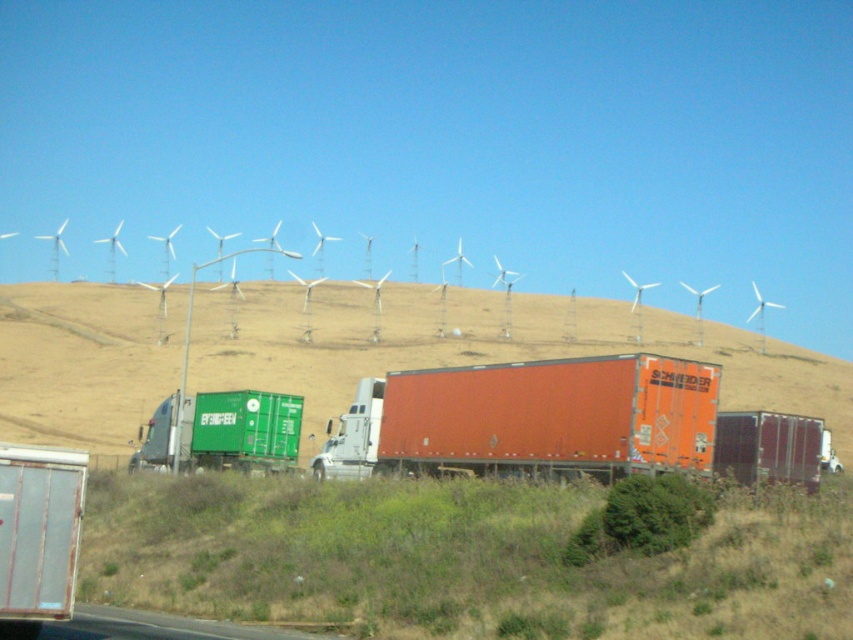
Does orange matte trailer truck at center have a greater height compared to white plastic wind turbines at upper center?

In fact, orange matte trailer truck at center may be shorter than white plastic wind turbines at upper center.

Is orange matte trailer truck at center thinner than white plastic wind turbines at upper center?

Indeed, orange matte trailer truck at center has a lesser width compared to white plastic wind turbines at upper center.

You are a GUI agent. You are given a task and a screenshot of the screen. Output one action in this format:
    pyautogui.click(x=<x>, y=<y>)
    Task: Click on the orange matte trailer truck at center
    
    Given the screenshot: What is the action you would take?
    pyautogui.click(x=531, y=419)

Find the location of a particular element. orange matte trailer truck at center is located at coordinates (531, 419).

Which is behind, point (140, 632) or point (115, 227)?

The point (115, 227) is more distant.

Locate an element on the screen. This screenshot has width=853, height=640. asphalt road at lower center is located at coordinates (160, 627).

Consider the image. Can you confirm if brown grassy hillside at center is positioned above orange matte trailer truck at center?

Yes, brown grassy hillside at center is above orange matte trailer truck at center.

Between point (276, 372) and point (639, 353), which one is positioned in front?

Point (639, 353) is in front.

In order to click on brown grassy hillside at center in this screenshot , I will do `click(480, 346)`.